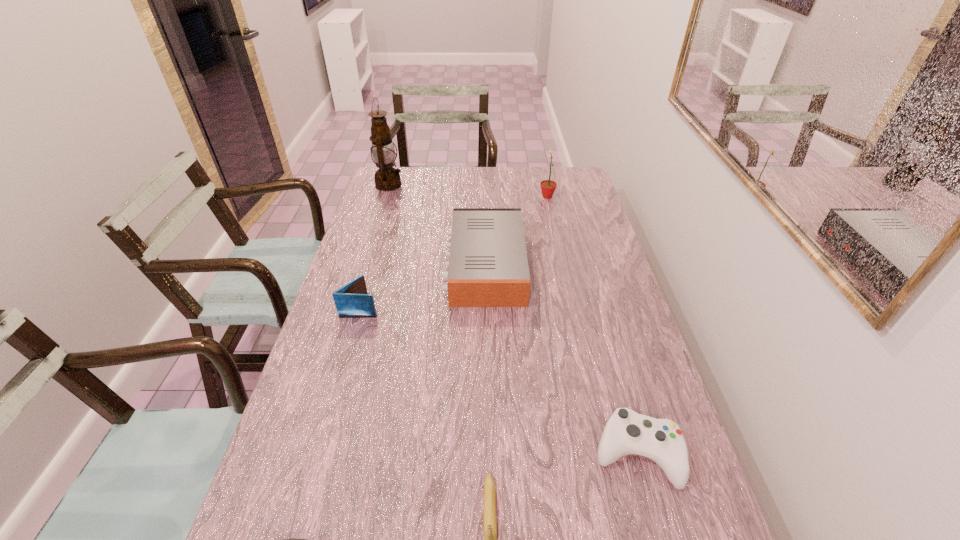
Identify which object is located as the third nearest to the sixth shortest object. Please provide its 2D coordinates. Your answer should be formatted as a tuple, i.e. [(x, y)], where the tuple contains the x and y coordinates of a point satisfying the conditions above.

[(352, 300)]

Select which object appears as the fifth closest to the sunflower. Please provide its 2D coordinates. Your answer should be formatted as a tuple, i.e. [(x, y)], where the tuple contains the x and y coordinates of a point satisfying the conditions above.

[(489, 498)]

This screenshot has height=540, width=960. I want to click on free space that satisfies the following two spatial constraints: 1. on the face of the farther control; 2. on the left side of the second tallest object, so click(604, 453).

Locate an element on the screen. Image resolution: width=960 pixels, height=540 pixels. vacant space that satisfies the following two spatial constraints: 1. on the front side of the farther control; 2. on the left side of the tallest object is located at coordinates (305, 453).

The image size is (960, 540). In order to click on free space in the image that satisfies the following two spatial constraints: 1. on the exterior surface of the wallet; 2. on the back side of the farther control in this screenshot , I will do `click(319, 453)`.

This screenshot has height=540, width=960. Find the location of `blank space that satisfies the following two spatial constraints: 1. on the control panel of the right control; 2. on the right side of the radio receiver`. blank space that satisfies the following two spatial constraints: 1. on the control panel of the right control; 2. on the right side of the radio receiver is located at coordinates (487, 453).

You are a GUI agent. You are given a task and a screenshot of the screen. Output one action in this format:
    pyautogui.click(x=<x>, y=<y>)
    Task: Click on the free location that satisfies the following two spatial constraints: 1. on the back side of the right control; 2. on the control panel of the radio receiver
    Image resolution: width=960 pixels, height=540 pixels.
    Given the screenshot: What is the action you would take?
    pyautogui.click(x=585, y=265)